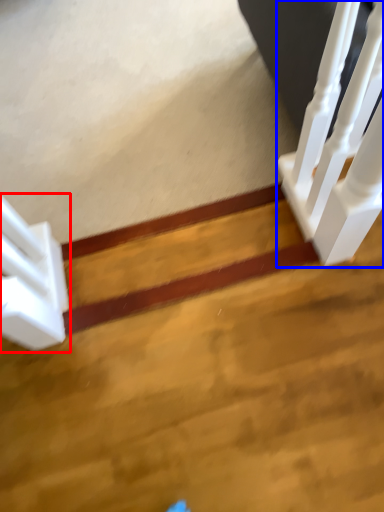
Question: Which of the following is the farthest to the observer, stairs (highlighted by a red box) or stairwell (highlighted by a blue box)?

Choices:
 (A) stairs
 (B) stairwell

Answer: (A)